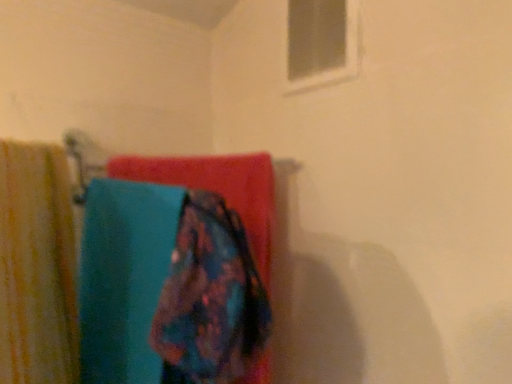
Question: From the image's perspective, does floral fabric towel at center appear lower than white plastic window at upper center?

Choices:
 (A) yes
 (B) no

Answer: (A)

Question: Is floral fabric towel at center to the right of white plastic window at upper center from the viewer's perspective?

Choices:
 (A) yes
 (B) no

Answer: (B)

Question: Is white plastic window at upper center at the back of floral fabric towel at center?

Choices:
 (A) yes
 (B) no

Answer: (B)

Question: From a real-world perspective, is floral fabric towel at center located higher than white plastic window at upper center?

Choices:
 (A) no
 (B) yes

Answer: (A)

Question: Does floral fabric towel at center come behind white plastic window at upper center?

Choices:
 (A) yes
 (B) no

Answer: (B)

Question: Looking at the image, does yellow striped fabric at left seem bigger or smaller compared to white plastic window at upper center?

Choices:
 (A) small
 (B) big

Answer: (B)

Question: In terms of width, does yellow striped fabric at left look wider or thinner when compared to white plastic window at upper center?

Choices:
 (A) thin
 (B) wide

Answer: (B)

Question: From the image's perspective, relative to white plastic window at upper center, is yellow striped fabric at left above or below?

Choices:
 (A) below
 (B) above

Answer: (A)

Question: Choose the correct answer: Is yellow striped fabric at left inside white plastic window at upper center or outside it?

Choices:
 (A) inside
 (B) outside

Answer: (B)

Question: Is white plastic window at upper center situated inside yellow striped fabric at left or outside?

Choices:
 (A) inside
 (B) outside

Answer: (B)

Question: Relative to yellow striped fabric at left, is white plastic window at upper center in front or behind?

Choices:
 (A) front
 (B) behind

Answer: (B)

Question: Visually, is white plastic window at upper center positioned to the left or to the right of yellow striped fabric at left?

Choices:
 (A) left
 (B) right

Answer: (B)

Question: From the image's perspective, relative to yellow striped fabric at left, is white plastic window at upper center above or below?

Choices:
 (A) above
 (B) below

Answer: (A)

Question: From the image's perspective, relative to floral fabric towel at center, is white plastic window at upper center above or below?

Choices:
 (A) above
 (B) below

Answer: (A)

Question: Does point (288, 23) appear closer or farther from the camera than point (233, 163)?

Choices:
 (A) closer
 (B) farther

Answer: (B)